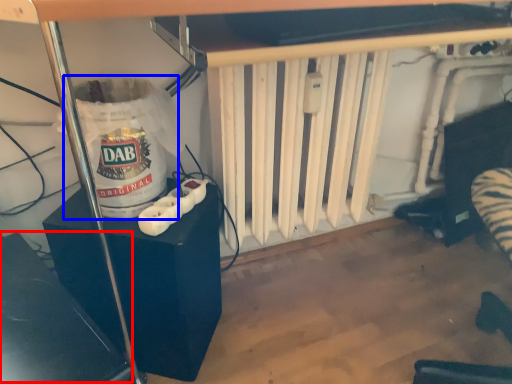
Question: Which object appears farthest to the camera in this image, wide (highlighted by a red box) or water heater (highlighted by a blue box)?

Choices:
 (A) wide
 (B) water heater

Answer: (B)